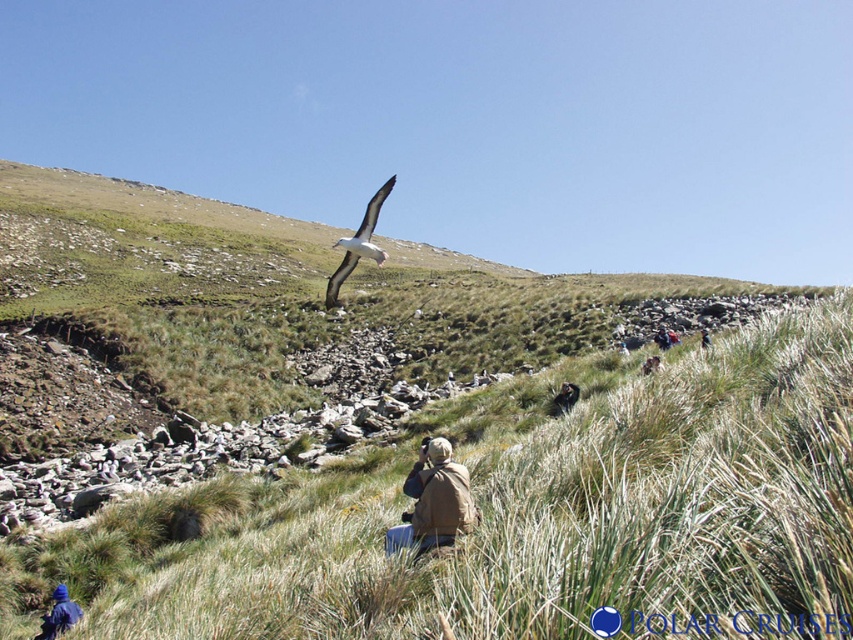
Question: Can you confirm if brown suede jacket at center is positioned to the right of brown leather jacket at upper center?

Choices:
 (A) no
 (B) yes

Answer: (A)

Question: Estimate the real-world distances between objects in this image. Which object is farther from the blue fabric jacket at lower left?

Choices:
 (A) brown leather jacket at lower center
 (B) brown leather jacket at center
 (C) white feathered bird at upper center
 (D) brown leather jacket at upper center

Answer: (D)

Question: Which object is farther from the camera taking this photo?

Choices:
 (A) brown leather jacket at center
 (B) brown leather jacket at lower center

Answer: (B)

Question: Which object is farther from the camera taking this photo?

Choices:
 (A) brown suede jacket at center
 (B) blue fabric jacket at lower left
 (C) brown leather jacket at lower center

Answer: (C)

Question: Does blue fabric jacket at lower left have a larger size compared to brown leather jacket at center?

Choices:
 (A) yes
 (B) no

Answer: (B)

Question: Does brown leather jacket at lower center appear on the left side of brown leather jacket at center?

Choices:
 (A) no
 (B) yes

Answer: (B)